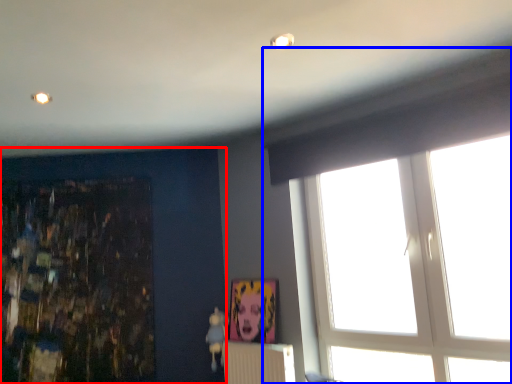
Question: Which of the following is the closest to the observer, backdrop (highlighted by a red box) or window (highlighted by a blue box)?

Choices:
 (A) backdrop
 (B) window

Answer: (B)